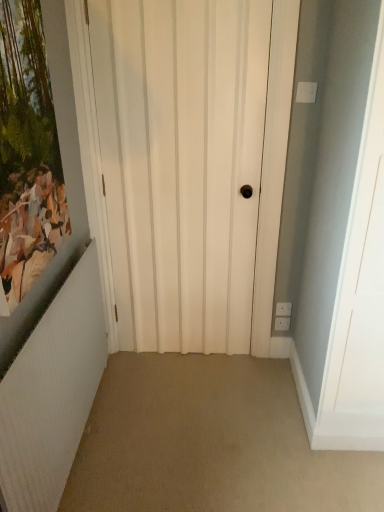
Question: From the image's perspective, is white matte door at center above or below white textured radiator at left?

Choices:
 (A) above
 (B) below

Answer: (A)

Question: Considering the positions of white matte door at center and white textured radiator at left in the image, is white matte door at center taller or shorter than white textured radiator at left?

Choices:
 (A) short
 (B) tall

Answer: (B)

Question: Estimate the real-world distances between objects in this image. Which object is farther from the matte wooden picture frame at left?

Choices:
 (A) white matte door at center
 (B) white textured radiator at left

Answer: (A)

Question: Which is nearer to the matte wooden picture frame at left?

Choices:
 (A) white matte door at center
 (B) white textured radiator at left

Answer: (B)